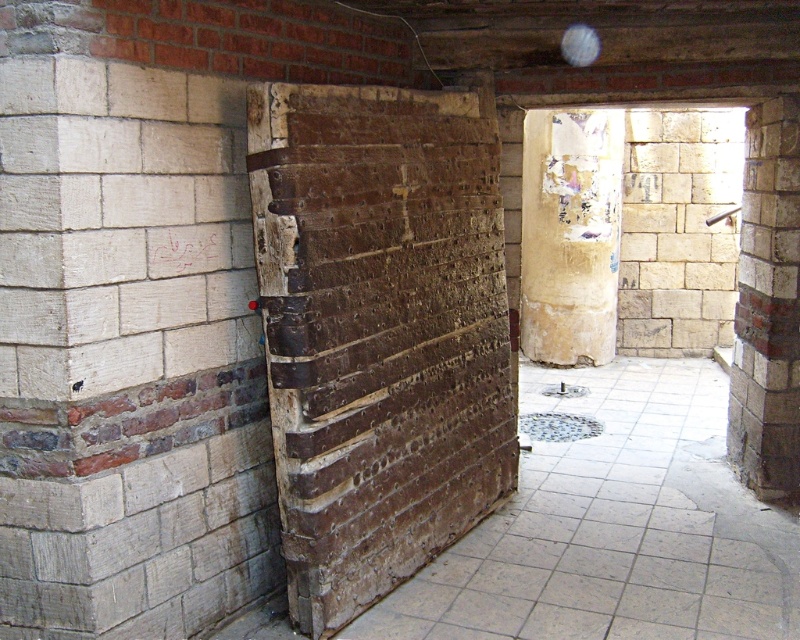
You are an interior designer assessing the room layout. You need to place a decorative item that requires a wider surface between the weathered brown brick at center and the light beige stone wall at right. Which surface should you choose?

The weathered brown brick at center has a greater width than the light beige stone wall at right, so the decorative item should be placed on the weathered brown brick at center.

You are an interior designer assessing the height of materials in a room. You observe the weathered brown brick at center and the light beige stone wall at right. Which material surface is shorter in height?

The weathered brown brick at center is not as tall as the light beige stone wall at right, so the weathered brown brick at center is shorter in height.